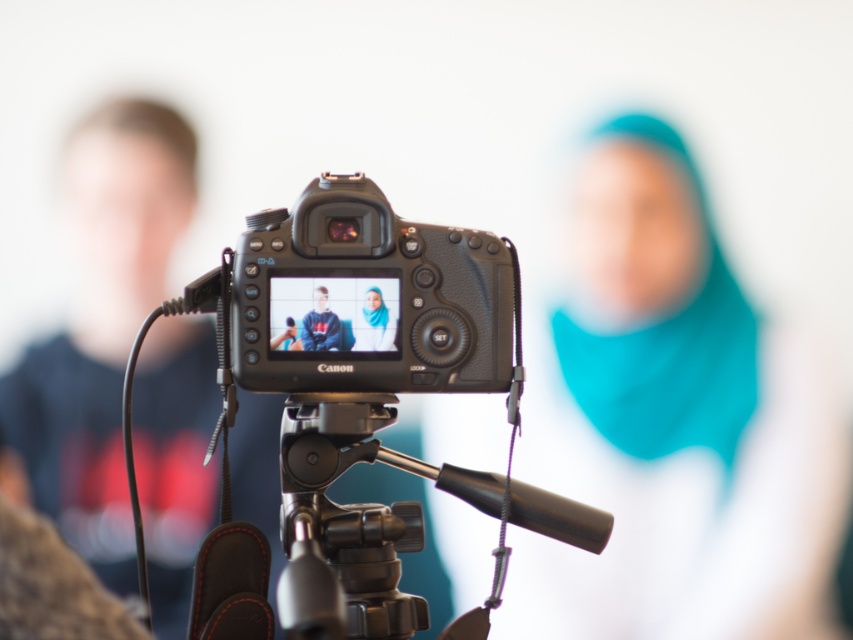
Who is more forward, (378, 346) or (323, 298)?

Positioned in front is point (323, 298).

Looking at this image, who is positioned more to the left, matte plastic camera at center or matte black hoodie at center?

From the viewer's perspective, matte black hoodie at center appears more on the left side.

This screenshot has height=640, width=853. What do you see at coordinates (334, 314) in the screenshot?
I see `matte plastic camera at center` at bounding box center [334, 314].

Identify the location of matte plastic camera at center. (334, 314).

Is black matte/video camera at center behind black matte canon camera at center?

No, black matte/video camera at center is closer to the viewer.

Based on the photo, measure the distance between point (280, 227) and camera.

A distance of 1.20 meters exists between point (280, 227) and camera.

At what (x,y) coordinates should I click in order to perform the action: click on black matte/video camera at center. Please return your answer as a coordinate pair (x, y). Looking at the image, I should click on (337, 476).

You are a GUI agent. You are given a task and a screenshot of the screen. Output one action in this format:
    pyautogui.click(x=<x>, y=<y>)
    Task: Click on the black matte/video camera at center
    This screenshot has height=640, width=853.
    Given the screenshot: What is the action you would take?
    point(337,476)

Does black matte canon camera at center have a smaller size compared to matte blue scarf at center?

Actually, black matte canon camera at center might be larger than matte blue scarf at center.

Can you confirm if black matte canon camera at center is wider than matte blue scarf at center?

Yes.

At what (x,y) coordinates should I click in order to perform the action: click on black matte canon camera at center. Please return your answer as a coordinate pair (x, y). Looking at the image, I should click on (363, 296).

In order to click on black matte canon camera at center in this screenshot , I will do `click(363, 296)`.